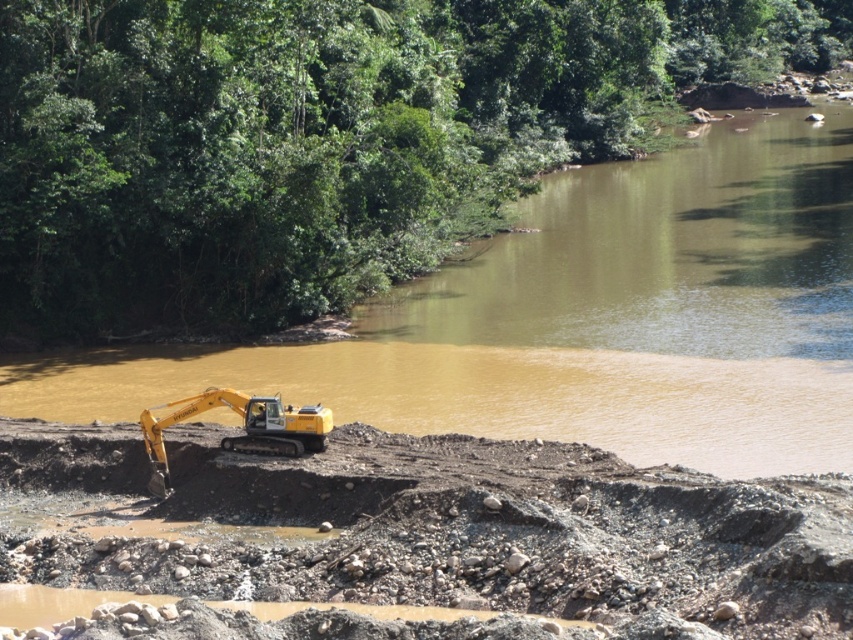
Question: Does brown muddy water at center appear on the left side of yellow rubber excavator at lower left?

Choices:
 (A) yes
 (B) no

Answer: (B)

Question: Is brown muddy water at center above yellow tracked excavator at lower left?

Choices:
 (A) no
 (B) yes

Answer: (B)

Question: Which of these objects is positioned closest to the brown muddy water at center?

Choices:
 (A) yellow tracked excavator at lower left
 (B) yellow rubber excavator at lower left

Answer: (A)

Question: Which object appears closest to the camera in this image?

Choices:
 (A) yellow tracked excavator at lower left
 (B) yellow rubber excavator at lower left
 (C) brown muddy water at center

Answer: (A)

Question: Is brown muddy water at center smaller than yellow tracked excavator at lower left?

Choices:
 (A) no
 (B) yes

Answer: (A)

Question: Which of the following is the farthest from the observer?

Choices:
 (A) yellow rubber excavator at lower left
 (B) brown muddy water at center
 (C) yellow tracked excavator at lower left

Answer: (A)